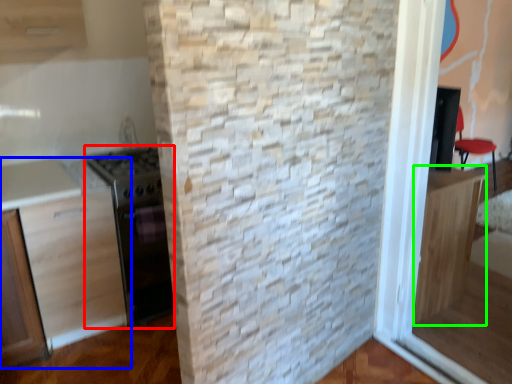
Question: Which object is the closest to the appliance (highlighted by a red box)? Choose among these: cabinetry (highlighted by a blue box) or cabinetry (highlighted by a green box).

Choices:
 (A) cabinetry
 (B) cabinetry

Answer: (A)